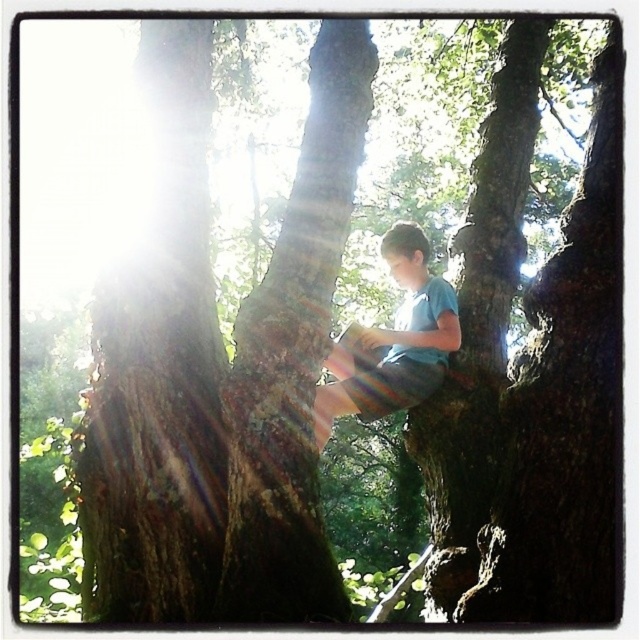
Question: Is brown rough bark at center thinner than light blue striped shorts at center?

Choices:
 (A) yes
 (B) no

Answer: (A)

Question: Which point is farther from the camera taking this photo?

Choices:
 (A) (276, 362)
 (B) (132, 394)
 (C) (433, 356)

Answer: (C)

Question: Is smooth brown bark at left positioned behind light blue striped shorts at center?

Choices:
 (A) no
 (B) yes

Answer: (A)

Question: Is smooth brown bark at left in front of brown rough bark at center?

Choices:
 (A) no
 (B) yes

Answer: (A)

Question: Estimate the real-world distances between objects in this image. Which object is farther from the brown rough bark at center?

Choices:
 (A) light blue striped shorts at center
 (B) smooth brown bark at left

Answer: (A)

Question: Which object appears closest to the camera in this image?

Choices:
 (A) smooth brown bark at left
 (B) brown rough bark at center

Answer: (B)